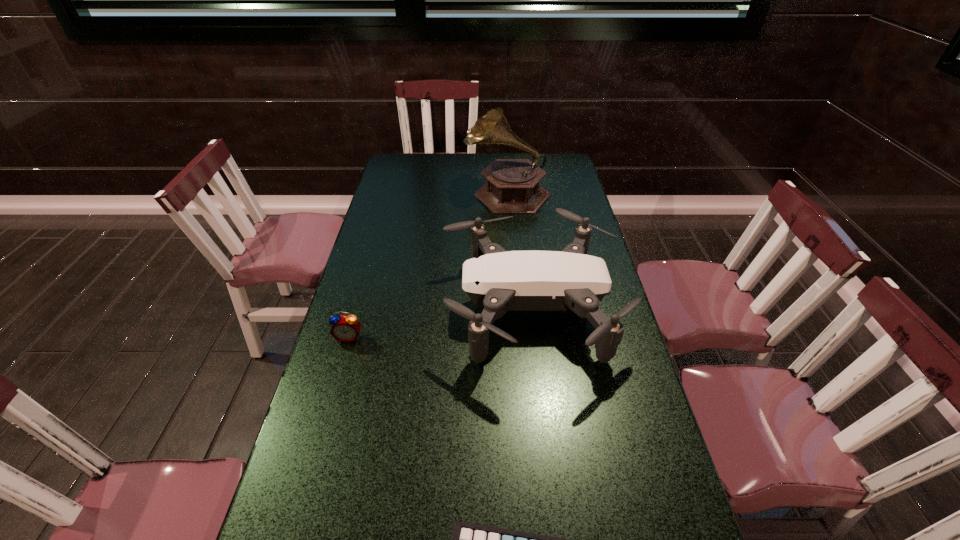
Locate an element on the screen. the tallest object is located at coordinates (512, 187).

Where is `phonograph record`? The height and width of the screenshot is (540, 960). phonograph record is located at coordinates (512, 187).

At what (x,y) coordinates should I click in order to perform the action: click on the third shortest object. Please return your answer as a coordinate pair (x, y). The width and height of the screenshot is (960, 540). Looking at the image, I should click on (496, 280).

Identify the location of the leftmost object. Image resolution: width=960 pixels, height=540 pixels. (346, 328).

What are the coordinates of `alarm clock` in the screenshot? It's located at (346, 328).

This screenshot has height=540, width=960. What are the coordinates of `free space located 0.300m on the horn direction of the farthest object` in the screenshot? It's located at (390, 192).

The image size is (960, 540). Identify the location of vacant space located on the horn direction of the farthest object. (x=387, y=192).

At what (x,y) coordinates should I click in order to perform the action: click on free spot located 0.320m on the horn direction of the farthest object. Please return your answer as a coordinate pair (x, y). Looking at the image, I should click on (384, 192).

The height and width of the screenshot is (540, 960). Identify the location of free space located 0.080m on the camera side of the drone. (415, 307).

Locate an element on the screen. vacant space situated 0.050m on the camera side of the drone is located at coordinates (425, 307).